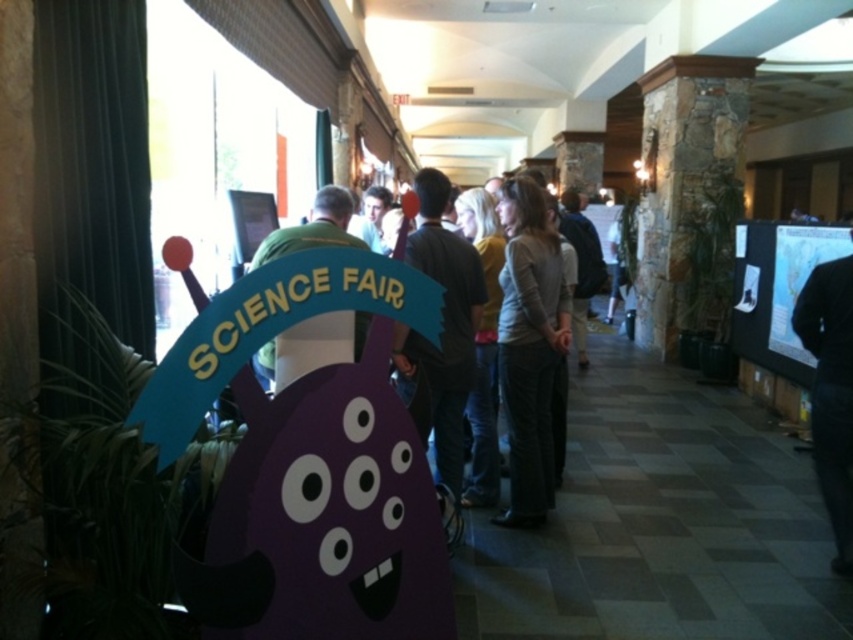
You are a participant at the science fair and you want to place a small object on the floor without it falling off. You have a stone at right and a dark gray sweater at center. Which object should you choose to place your item on?

The stone at right is positioned over dark gray sweater at center, so placing an item on the stone at right would be more stable since it is higher up and less likely to tip over.

You are a photographer standing in the hallway and want to take a photo of the green matte shirt at center without the black fabric at right blocking it. How should you adjust your position?

Move to the left side of the hallway so that the green matte shirt at center is no longer blocked by the black fabric at right.

You are a student participating in the science fair and need to place a 2.5 meter long poster between the stone at right and the dark gray sweater at center. Can you fit the poster horizontally between them?

The distance between the stone at right and the dark gray sweater at center is 5.44 meters, which is greater than the 2.5 meter length of the poster. Therefore, the poster can be placed horizontally between them with sufficient space remaining.